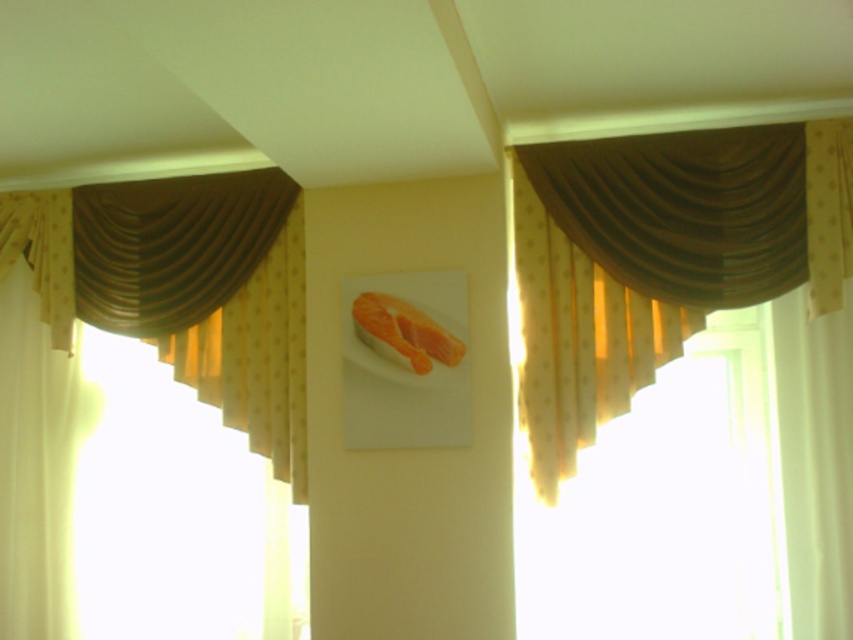
You are an interior designer assessing the symmetry of the room. You notice the brown sheer curtain at upper right and the brown satin curtain at upper left. Which one is taller?

The brown sheer curtain at upper right is taller than the brown satin curtain at upper left.

You are an interior designer assessing the window treatments in the room. You notice the brown sheer curtain at upper right and the brown satin curtain at upper left. Which of these two curtains is narrower in width?

The brown sheer curtain at upper right has a lesser width compared to the brown satin curtain at upper left, so it is narrower.